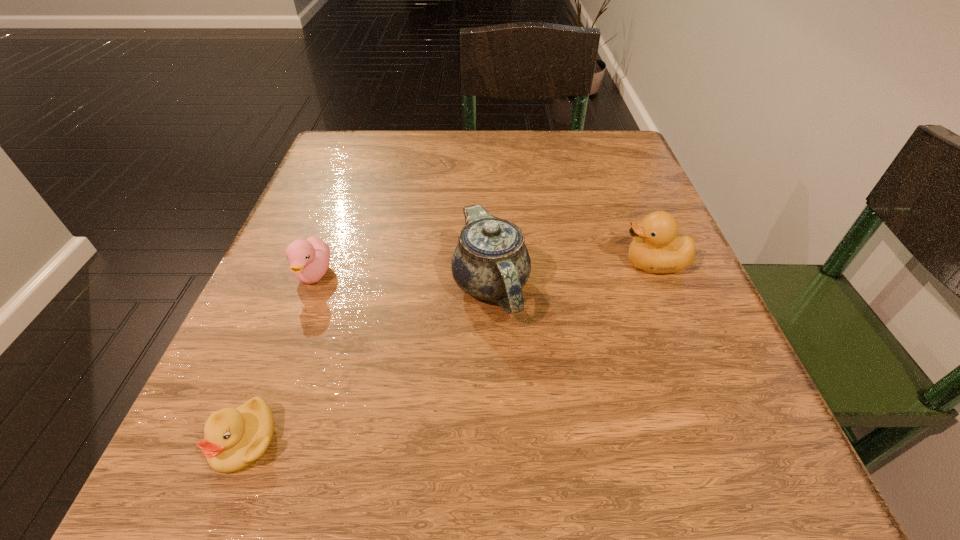
The image size is (960, 540). I want to click on the third object from left to right, so click(491, 262).

Image resolution: width=960 pixels, height=540 pixels. Identify the location of chinaware. tap(491, 262).

This screenshot has width=960, height=540. I want to click on the rightmost duckling, so click(657, 248).

You are a GUI agent. You are given a task and a screenshot of the screen. Output one action in this format:
    pyautogui.click(x=<x>, y=<y>)
    Task: Click on the rightmost object
    
    Given the screenshot: What is the action you would take?
    pyautogui.click(x=657, y=248)

This screenshot has height=540, width=960. What are the coordinates of `the second tallest duckling` in the screenshot? It's located at (309, 259).

Where is `the nearest duckling`? This screenshot has height=540, width=960. the nearest duckling is located at coordinates (234, 439).

Identify the location of the shortest object. This screenshot has height=540, width=960. (234, 439).

Where is `blank space located from the spout of the chinaware`? This screenshot has height=540, width=960. blank space located from the spout of the chinaware is located at coordinates (495, 489).

The image size is (960, 540). In order to click on vacant point located 0.110m facing forward on the rightmost duckling in this screenshot , I will do coord(552,264).

Find the location of a particular element. This screenshot has height=540, width=960. vacant region located 0.390m facing forward on the rightmost duckling is located at coordinates (380, 264).